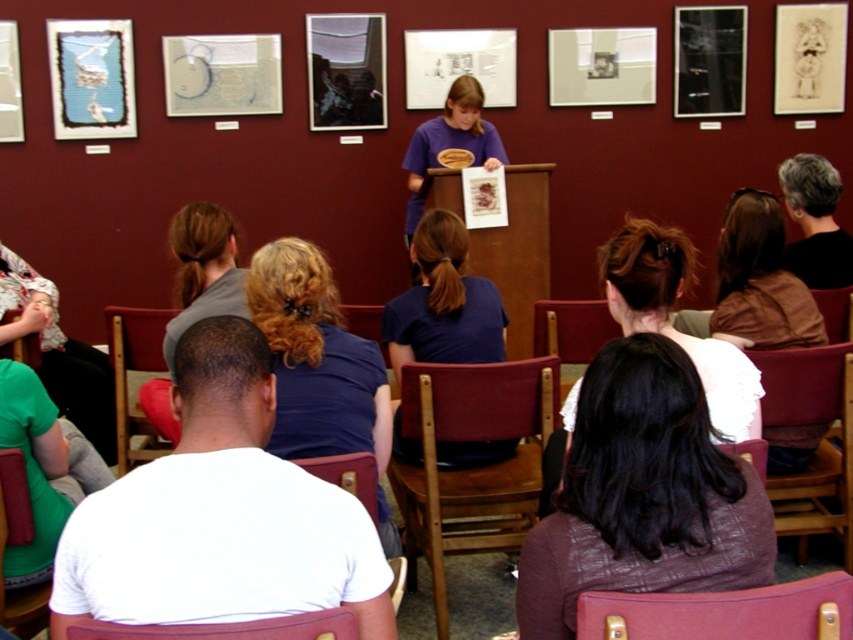
Question: Is wooden chair at center above leather-like red chair at lower right?

Choices:
 (A) no
 (B) yes

Answer: (B)

Question: Estimate the real-world distances between objects in this image. Which object is farther from the blue fabric hair at center?

Choices:
 (A) maroon fabric chair at center
 (B) wooden chair at lower left
 (C) brown hair at center

Answer: (B)

Question: Which of the following is the closest to the observer?

Choices:
 (A) pos(7,458)
 (B) pos(724,436)
 (C) pos(578,356)
 (D) pos(328,349)

Answer: (B)

Question: Which of the following is the farthest from the observer?

Choices:
 (A) green fabric shirt at lower left
 (B) wooden chair at lower left
 (C) blue fabric hair at center
 (D) leather-like red chair at lower right

Answer: (A)

Question: Is wooden chair at center to the right of leather-like red chair at lower right from the viewer's perspective?

Choices:
 (A) no
 (B) yes

Answer: (B)

Question: Can you confirm if blue fabric hair at center is positioned above leather-like red chair at lower right?

Choices:
 (A) yes
 (B) no

Answer: (A)